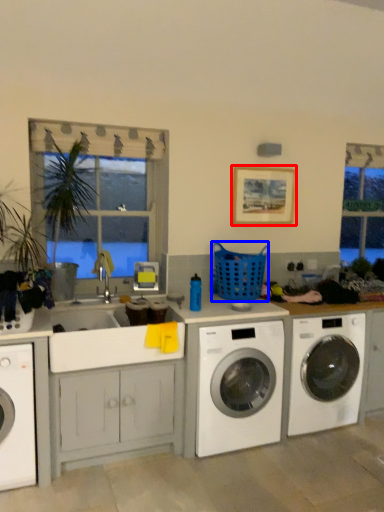
Question: Which point is further to the camera, picture frame (highlighted by a red box) or basket (highlighted by a blue box)?

Choices:
 (A) picture frame
 (B) basket

Answer: (A)